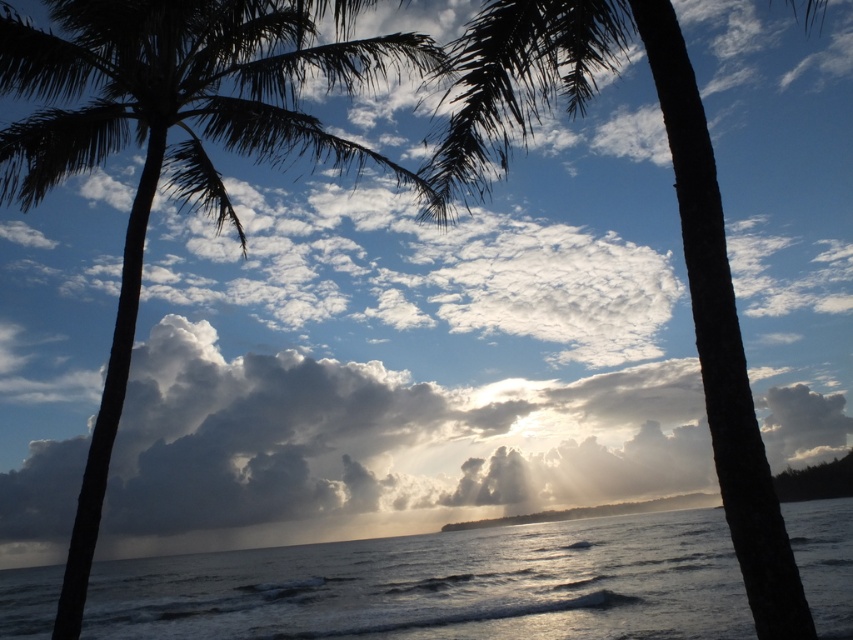
Question: Does cloudy sky at center appear on the right side of glistening silver water at center?

Choices:
 (A) yes
 (B) no

Answer: (A)

Question: Which object is farther from the camera taking this photo?

Choices:
 (A) cloudy sky at center
 (B) silky black palm tree at left

Answer: (A)

Question: Can you confirm if silky black palm tree at left is thinner than dark brown bark palm tree at center?

Choices:
 (A) no
 (B) yes

Answer: (B)

Question: Which point is closer to the camera?

Choices:
 (A) (459, 413)
 (B) (538, 84)
 (C) (112, 138)
 (D) (347, 637)

Answer: (C)

Question: Based on their relative distances, which object is nearer to the cloudy sky at center?

Choices:
 (A) silky black palm tree at left
 (B) dark brown bark palm tree at center

Answer: (B)

Question: Is cloudy sky at center to the right of dark brown bark palm tree at center from the viewer's perspective?

Choices:
 (A) no
 (B) yes

Answer: (A)